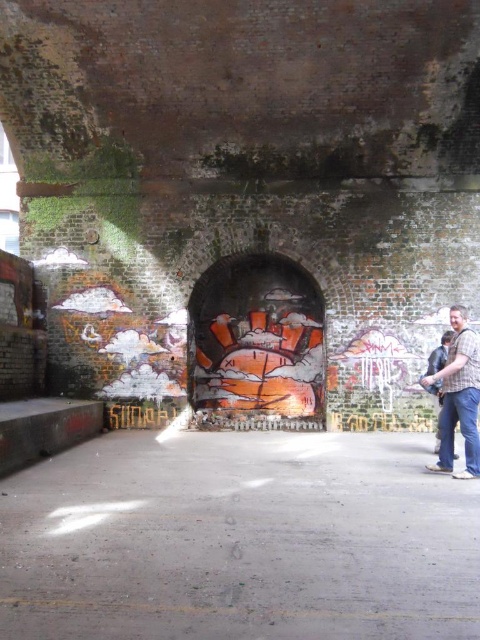
You are a delivery person standing at the entrance of the arched brick structure. You need to place a package between the matte brown jacket at right and the plaid shirt at right. The package is 7 feet long. Can you fit the package between them without bending it?

The distance between the matte brown jacket at right and the plaid shirt at right is 6.97 feet, so the package cannot fit as it is slightly longer than the available space.

You are a photographer standing in front of the arched brick structure. You notice two items on the ground at the right side of the scene. Which item is closer to the ground between the matte brown jacket at right and the plaid shirt at right?

The matte brown jacket at right is closer to the ground because it is positioned below the plaid shirt at right.

You are standing in an urban area and see a matte brown jacket at right and a plaid shirt at right. Which item takes up more space visually?

The plaid shirt at right takes up more space visually than the matte brown jacket at right because the matte brown jacket at right occupies less space than plaid shirt at right.